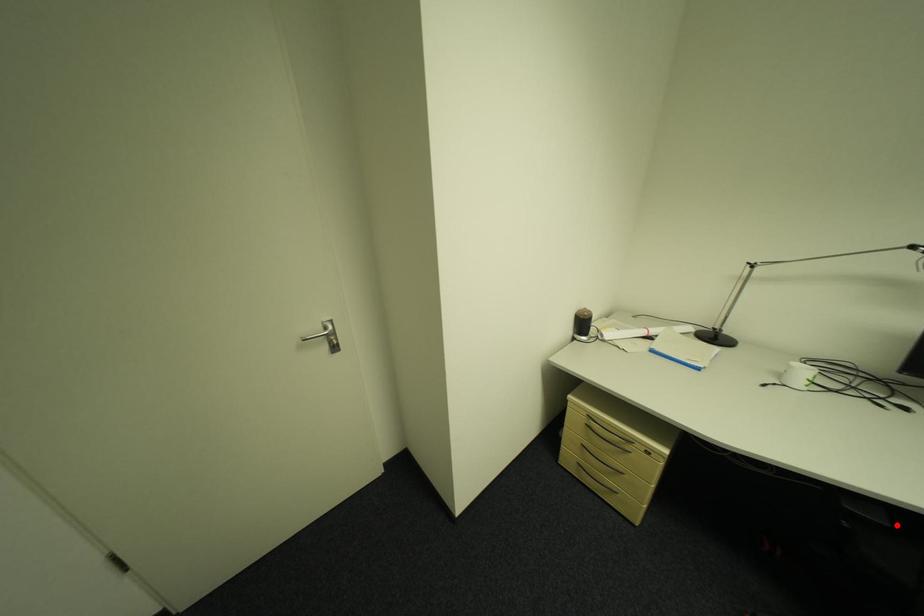
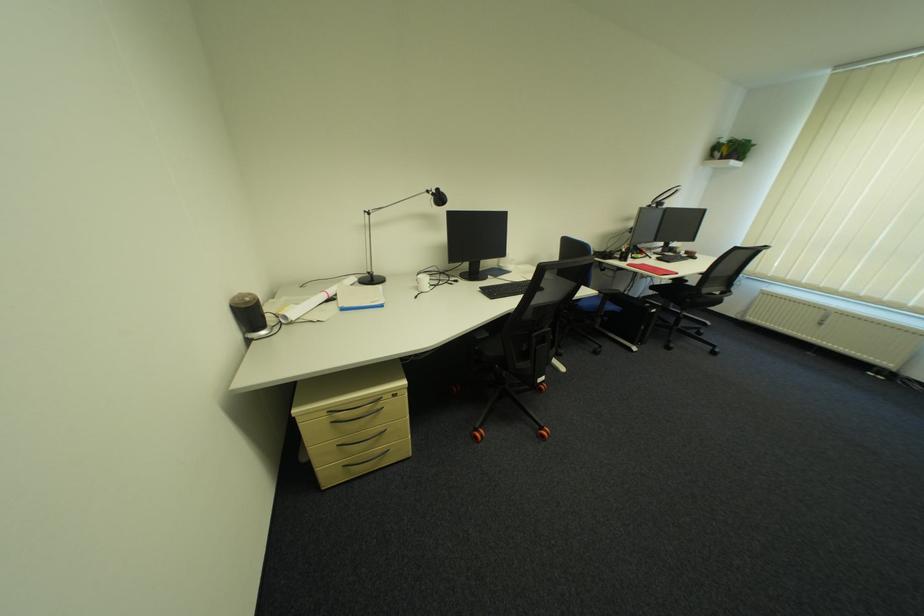
Question: I am providing you with two images of the same scene from different viewpoints. Given a red point in image1, look at the same physical point in image2. Is it:

Choices:
 (A) Closer to the viewpoint
 (B) Farther from the viewpoint

Answer: (B)